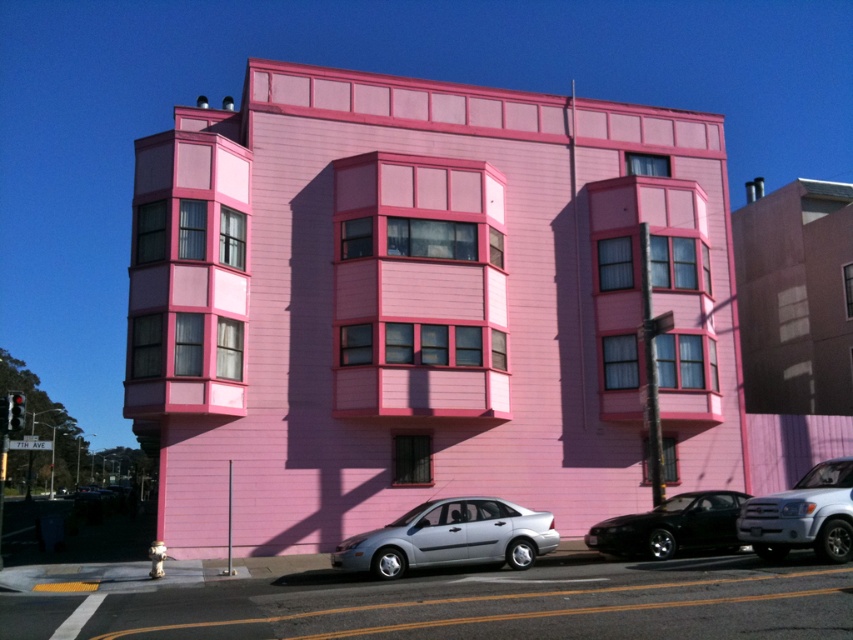
You are a pedestrian standing in front of the pink building. You see a satin silver sedan at center and a shiny black car at lower right. Which car is closer to you?

The satin silver sedan at center is closer to the viewer than the shiny black car at lower right.

You are standing at the center of the image and want to move towards the satin white suv at lower right. In which direction should you move?

You should move towards the lower right direction to reach the satin white suv at lower right.